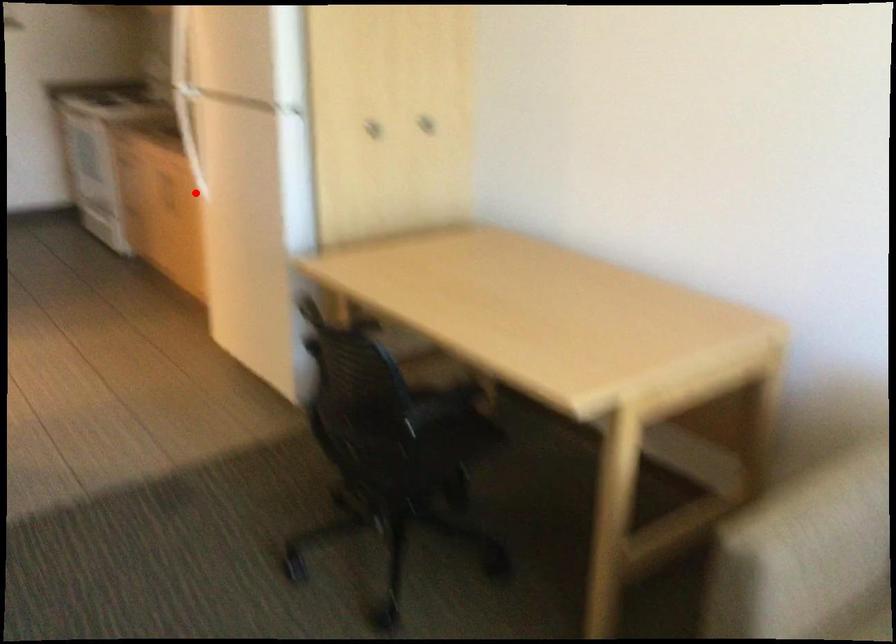
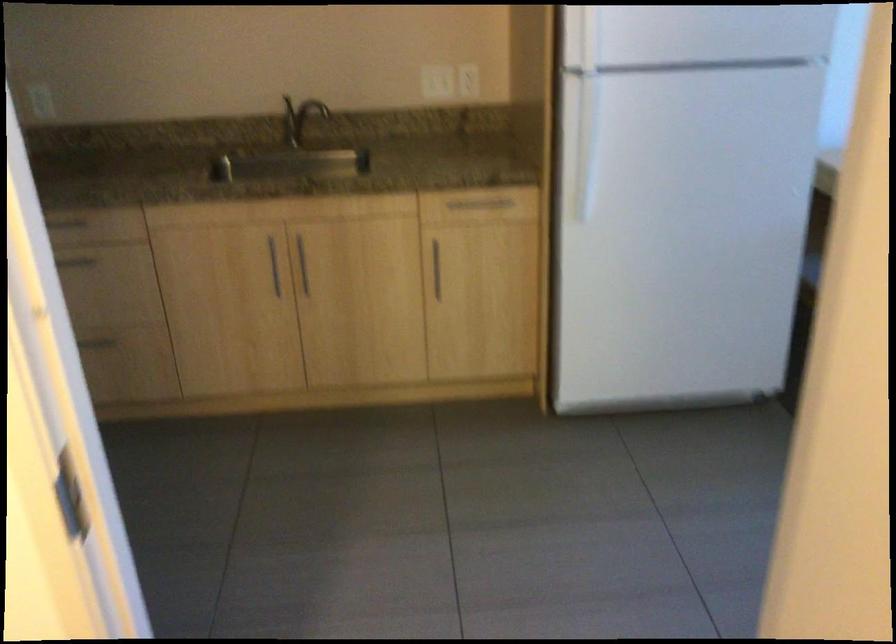
Question: I am providing you with two images of the same scene from different viewpoints. Image1 has a red point marked. In image2, the corresponding 3D location appears at what relative position? Reply with the corresponding letter.

Choices:
 (A) Closer
 (B) Farther

Answer: (A)